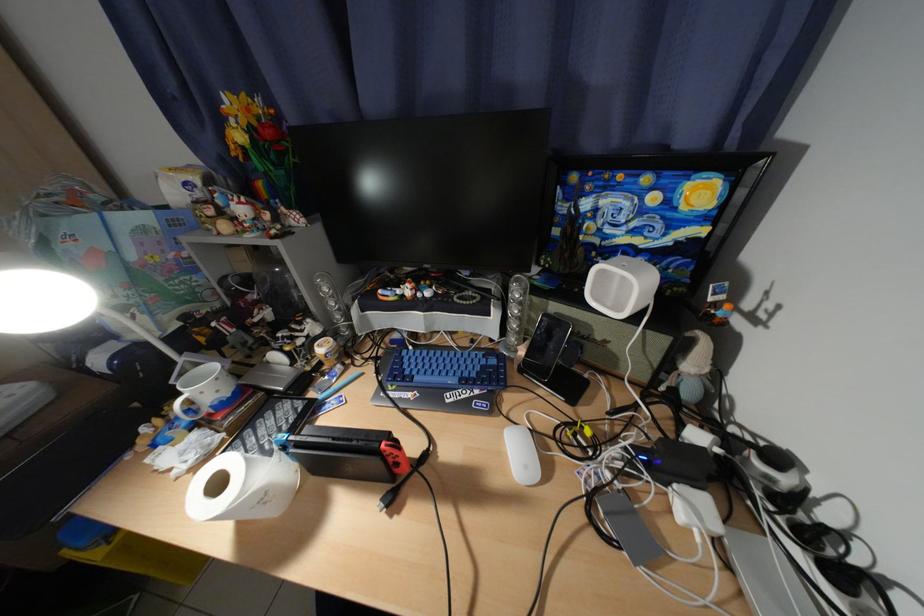
Which object does [691,367] point to?

This point indicates the Hello Kitty figurine.